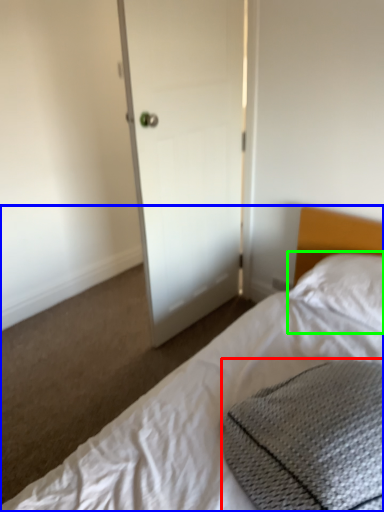
Question: Considering the real-world distances, which object is farthest from material (highlighted by a red box)? bed (highlighted by a blue box) or pillow (highlighted by a green box)?

Choices:
 (A) bed
 (B) pillow

Answer: (B)